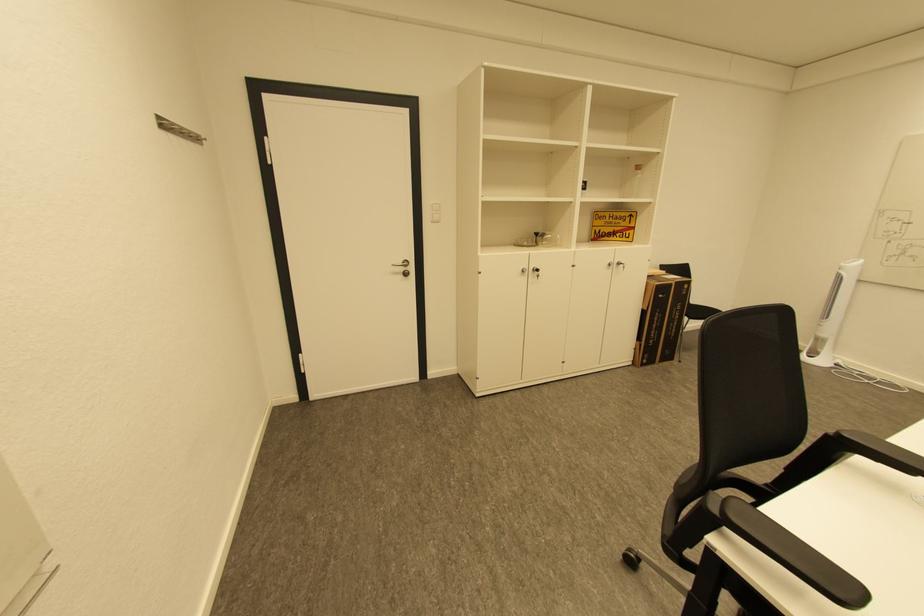
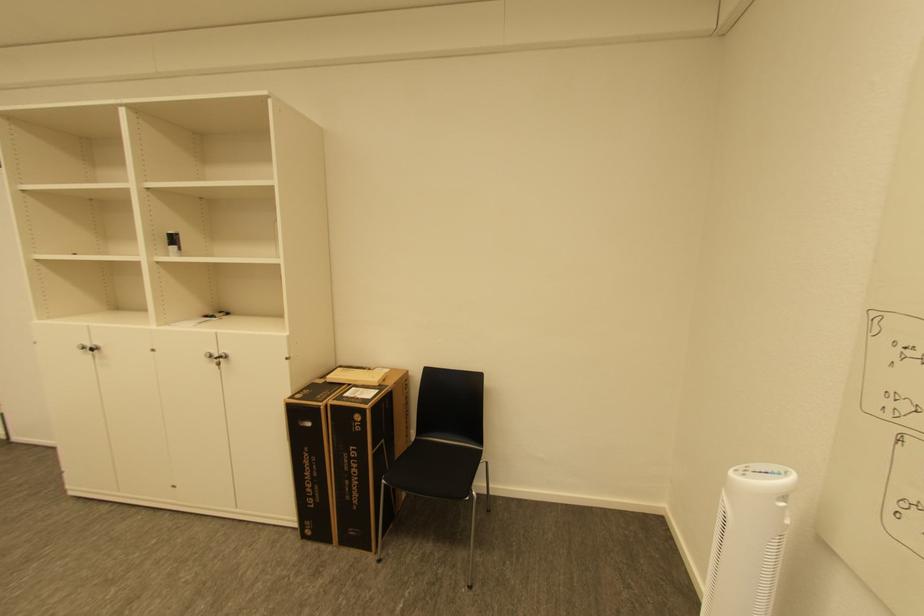
Find the pixel in the second image that matches (x=691, y=286) in the first image.

(363, 418)